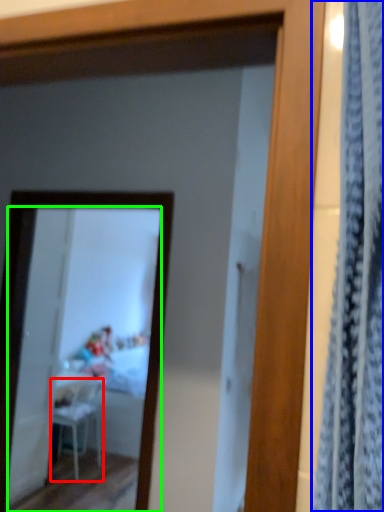
Question: Estimate the real-world distances between objects in this image. Which object is farther from chair (highlighted by a red box), curtain (highlighted by a blue box) or mirror (highlighted by a green box)?

Choices:
 (A) curtain
 (B) mirror

Answer: (A)